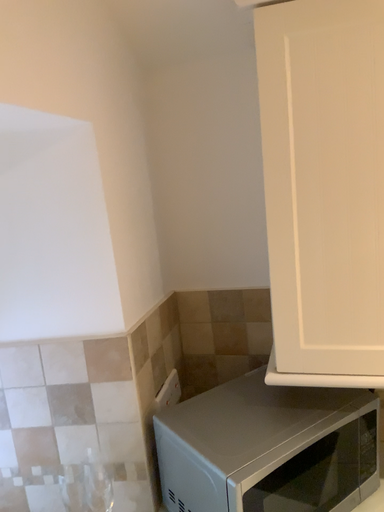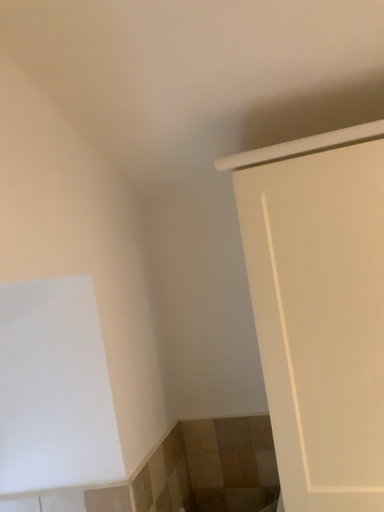
Question: How did the camera likely rotate when shooting the video?

Choices:
 (A) rotated downward
 (B) rotated upward

Answer: (B)